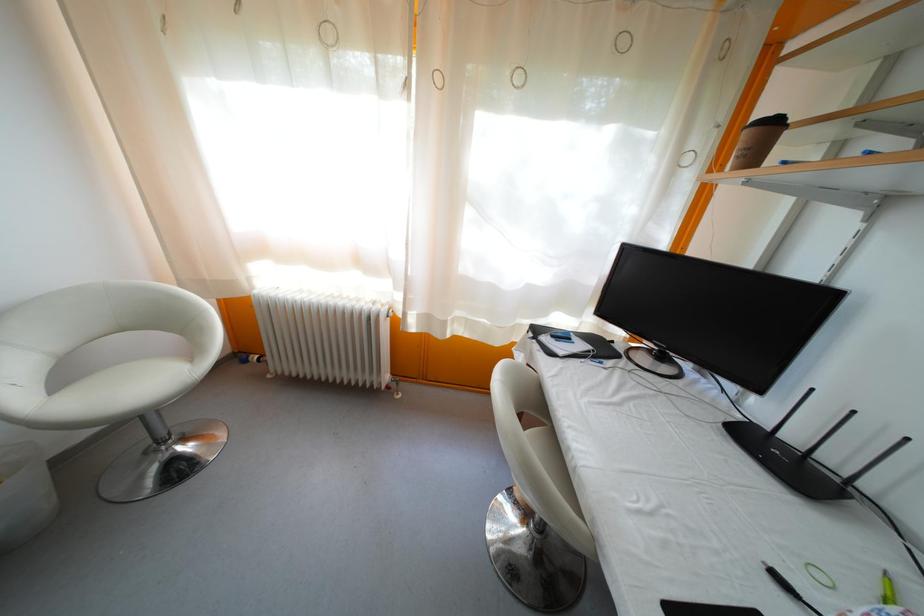
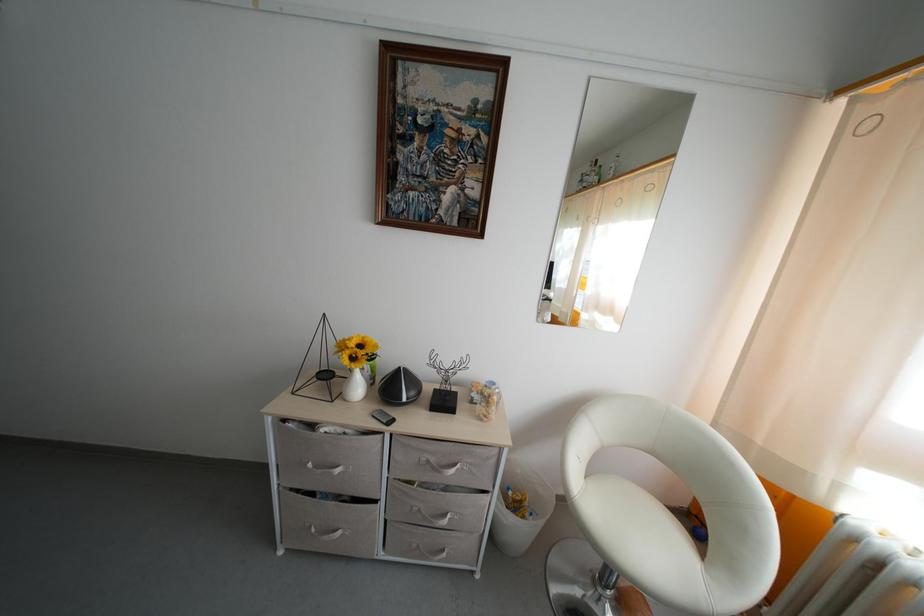
Question: The camera is either moving clockwise (left) or counter-clockwise (right) around the object. The first image is from the beginning of the video and the second image is from the end. Is the camera moving left or right when shooting the video?

Choices:
 (A) Left
 (B) Right

Answer: (B)